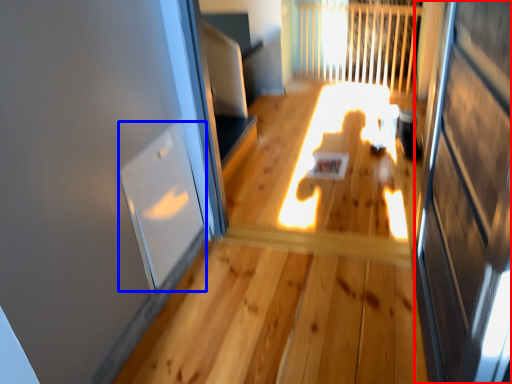
Question: Which point is closer to the camera, screen door (highlighted by a red box) or window (highlighted by a blue box)?

Choices:
 (A) screen door
 (B) window

Answer: (A)